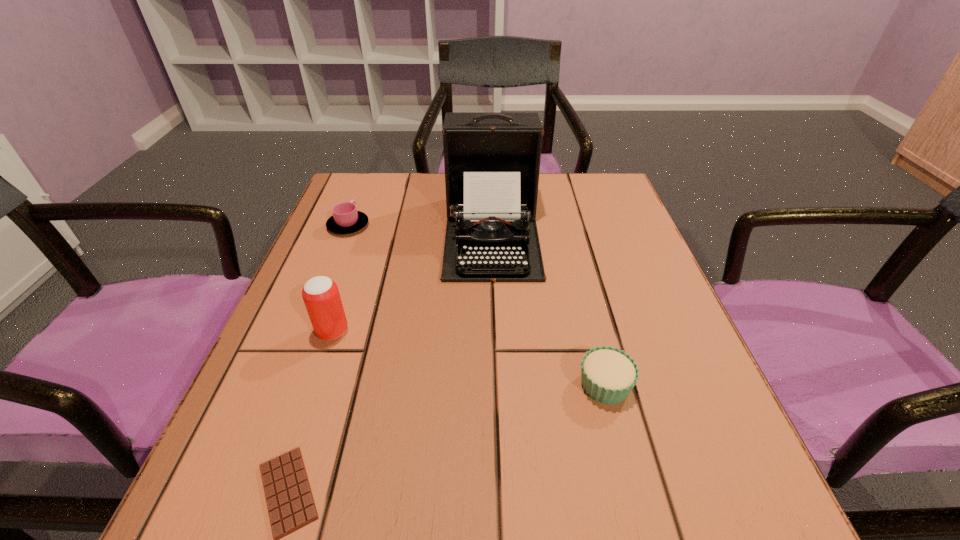
Identify the location of typewriter. (492, 159).

The height and width of the screenshot is (540, 960). I want to click on the second object from right to left, so click(492, 159).

Find the location of `beer can`. beer can is located at coordinates (320, 294).

You are a GUI agent. You are given a task and a screenshot of the screen. Output one action in this format:
    pyautogui.click(x=<x>, y=<y>)
    Task: Click on the second tallest object
    The image size is (960, 540).
    Given the screenshot: What is the action you would take?
    pyautogui.click(x=320, y=294)

Locate an element on the screen. cup is located at coordinates (346, 219).

You are a GUI agent. You are given a task and a screenshot of the screen. Output one action in this format:
    pyautogui.click(x=<x>, y=<y>)
    Task: Click on the cupcake
    The width and height of the screenshot is (960, 540).
    Given the screenshot: What is the action you would take?
    pyautogui.click(x=608, y=375)

Where is `the rightmost object`? the rightmost object is located at coordinates (608, 375).

Where is `free space located inside the open case of the fourth object from left to right`? free space located inside the open case of the fourth object from left to right is located at coordinates (494, 327).

Locate an element on the screen. vacant space located on the right of the third farthest object is located at coordinates pyautogui.click(x=509, y=331).

Where is `free space located 0.160m on the side with the handle of the cup`? free space located 0.160m on the side with the handle of the cup is located at coordinates (366, 183).